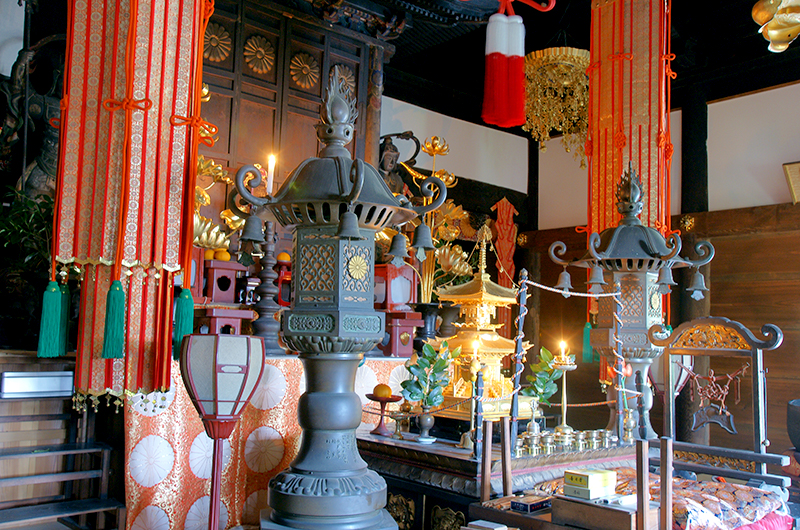
Locate an element on the screen. This screenshot has width=800, height=530. plant is located at coordinates (414, 391), (546, 388).